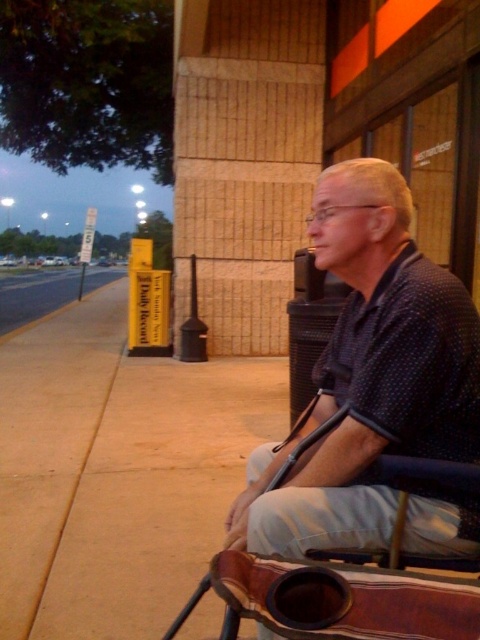
Which is below, polka dot shirt at center or paved asphalt at left?

Positioned lower is polka dot shirt at center.

Does polka dot shirt at center have a greater width compared to paved asphalt at left?

Incorrect, polka dot shirt at center's width does not surpass paved asphalt at left's.

Image resolution: width=480 pixels, height=640 pixels. In order to click on polka dot shirt at center in this screenshot , I will do `click(369, 374)`.